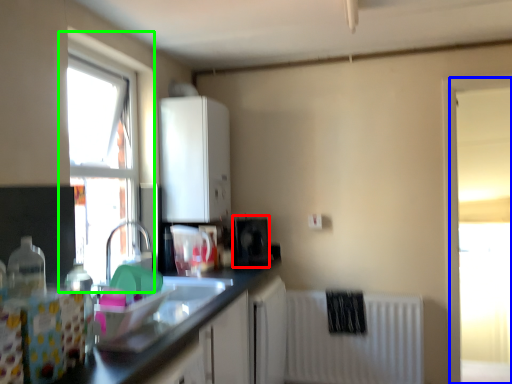
Question: Estimate the real-world distances between objects in this image. Which object is closer to appliance (highlighted by a red box), window (highlighted by a blue box) or window (highlighted by a green box)?

Choices:
 (A) window
 (B) window

Answer: (B)